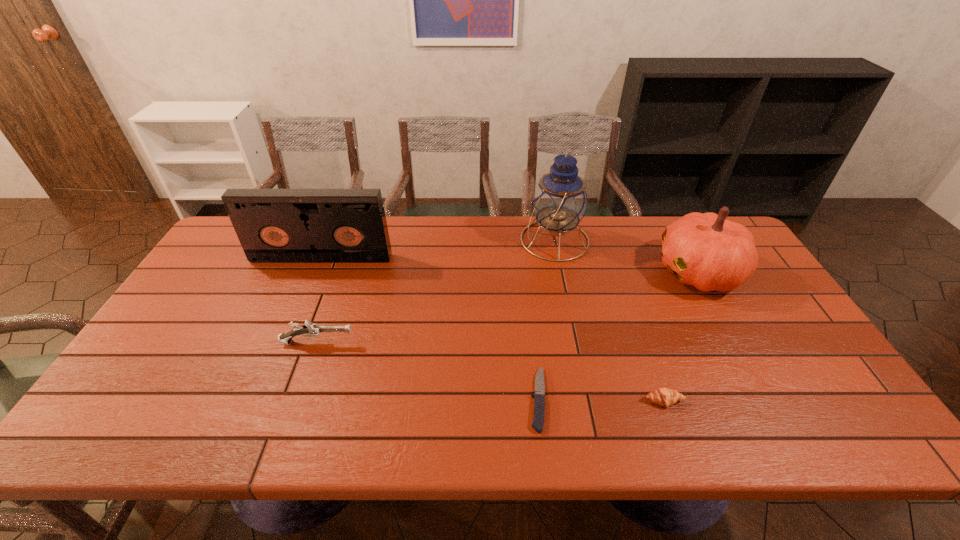
Identify which object is the third nearest to the shortest object. Please provide its 2D coordinates. Your answer should be formatted as a tuple, i.e. [(x, y)], where the tuple contains the x and y coordinates of a point satisfying the conditions above.

[(311, 330)]

The image size is (960, 540). I want to click on object identified as the closest to the videotape, so click(x=311, y=330).

The image size is (960, 540). I want to click on free spot that satisfies the following two spatial constraints: 1. on the front-facing side of the tallest object; 2. on the front side of the steak knife, so click(x=588, y=399).

Identify the location of vacant space that satisfies the following two spatial constraints: 1. on the front-facing side of the pumpkin; 2. on the front-facing side of the fifth object from left to right. The height and width of the screenshot is (540, 960). (771, 401).

In order to click on vacant space that satisfies the following two spatial constraints: 1. on the front-facing side of the pumpkin; 2. on the front-facing side of the second shortest object in this screenshot , I will do `click(771, 401)`.

Find the location of a particular element. The width and height of the screenshot is (960, 540). free space that satisfies the following two spatial constraints: 1. on the front-facing side of the rightmost object; 2. on the front-facing side of the fifth object from left to right is located at coordinates (771, 401).

I want to click on vacant region that satisfies the following two spatial constraints: 1. on the front-facing side of the rightmost object; 2. on the front-facing side of the second shortest object, so click(771, 401).

Where is `vacant space that satisfies the following two spatial constraints: 1. on the front-facing side of the pumpkin; 2. on the front side of the steak knife`? The width and height of the screenshot is (960, 540). vacant space that satisfies the following two spatial constraints: 1. on the front-facing side of the pumpkin; 2. on the front side of the steak knife is located at coordinates (770, 399).